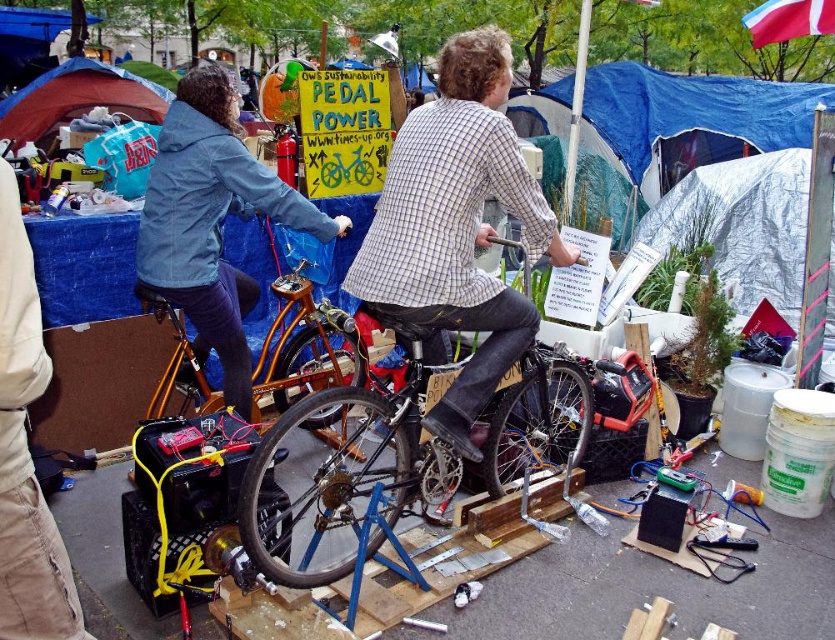
Which of these two, silver reflective tarp at right or blue tarp tent at upper left, stands taller?

With more height is silver reflective tarp at right.

Between point (800, 177) and point (58, 74), which one is positioned behind?

Point (58, 74)

Who is more forward, (747, 275) or (157, 84)?

Point (747, 275)

Where is `silver reflective tarp at right`? This screenshot has width=835, height=640. silver reflective tarp at right is located at coordinates (742, 225).

Is point (562, 419) positioned before point (24, 344)?

No, (562, 419) is further to viewer.

Who is taller, black matte bicycle at center or khaki cotton pants at lower left?

With more height is khaki cotton pants at lower left.

Find the location of a particular element. black matte bicycle at center is located at coordinates (342, 476).

Consider the image. Who is shorter, blue tarp at upper center or khaki cotton pants at lower left?

Standing shorter between the two is khaki cotton pants at lower left.

Between point (517, 88) and point (34, 545), which one is positioned behind?

The point (517, 88) is behind.

The image size is (835, 640). I want to click on blue tarp at upper center, so click(686, 122).